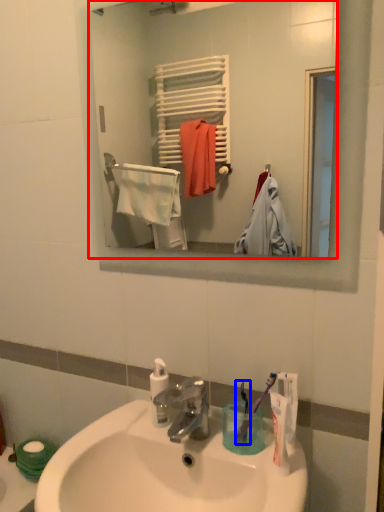
Question: Among these objects, which one is farthest to the camera, mirror (highlighted by a red box) or toothbrush (highlighted by a blue box)?

Choices:
 (A) mirror
 (B) toothbrush

Answer: (B)